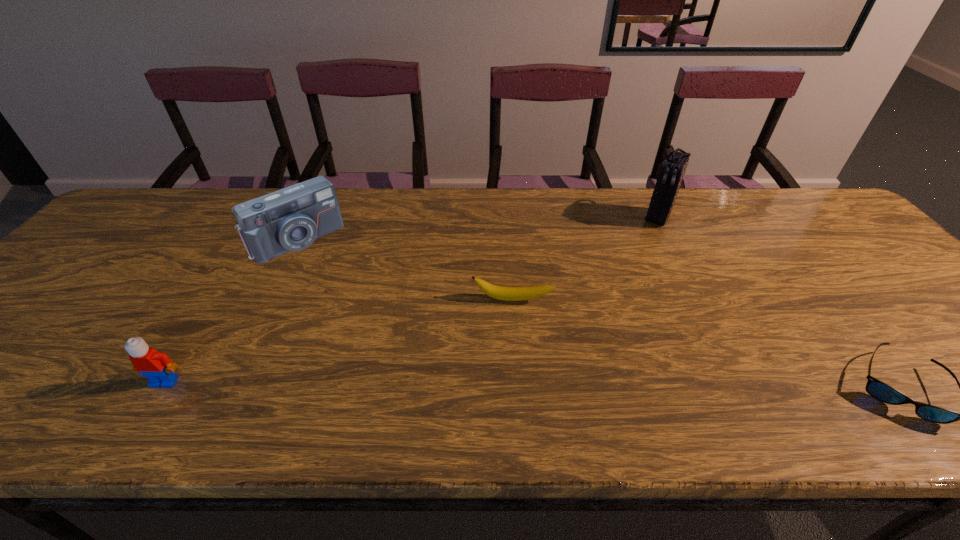
Where is `vacant space at the far left corner of the desktop`? Image resolution: width=960 pixels, height=540 pixels. vacant space at the far left corner of the desktop is located at coordinates (167, 216).

Where is `vacant space that is in between the clutch bag and the fourth tallest object`? Image resolution: width=960 pixels, height=540 pixels. vacant space that is in between the clutch bag and the fourth tallest object is located at coordinates (586, 258).

The width and height of the screenshot is (960, 540). Find the location of `vacant space in between the third object from right to left and the tallest object`. vacant space in between the third object from right to left and the tallest object is located at coordinates (586, 258).

Identify which object is the third nearest to the camera. Please provide its 2D coordinates. Your answer should be formatted as a tuple, i.e. [(x, y)], where the tuple contains the x and y coordinates of a point satisfying the conditions above.

[(672, 170)]

Locate an element on the screen. object that is the fourth nearest to the camera is located at coordinates (881, 391).